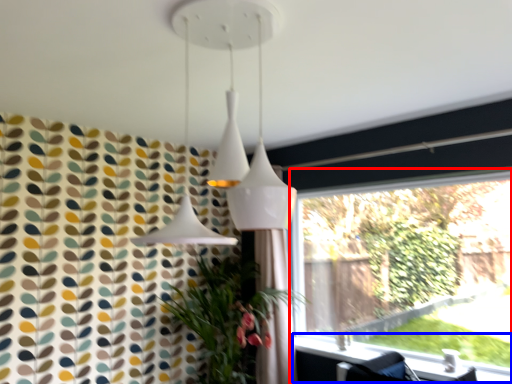
Question: Which object is closer to the camera taking this photo, window (highlighted by a red box) or window sill (highlighted by a blue box)?

Choices:
 (A) window
 (B) window sill

Answer: (B)